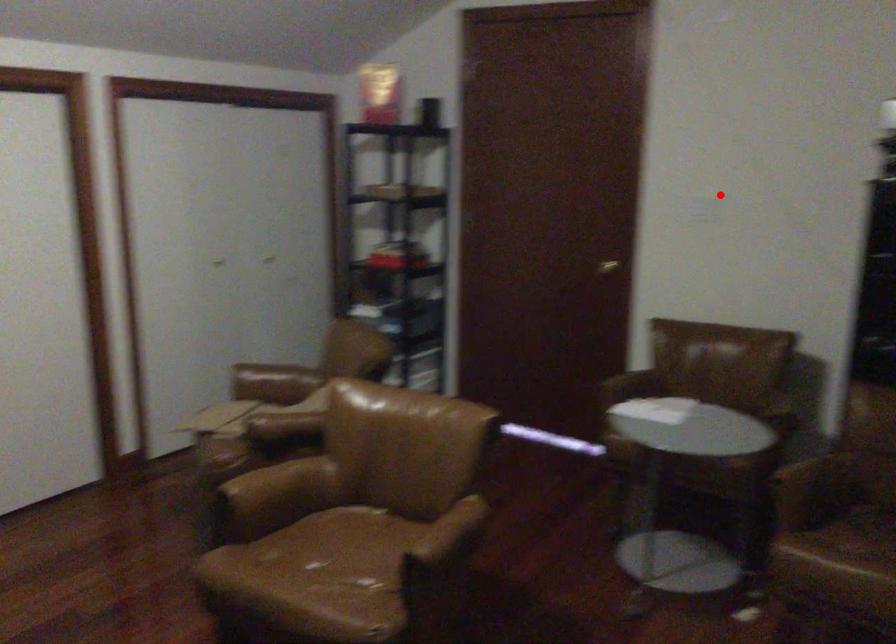
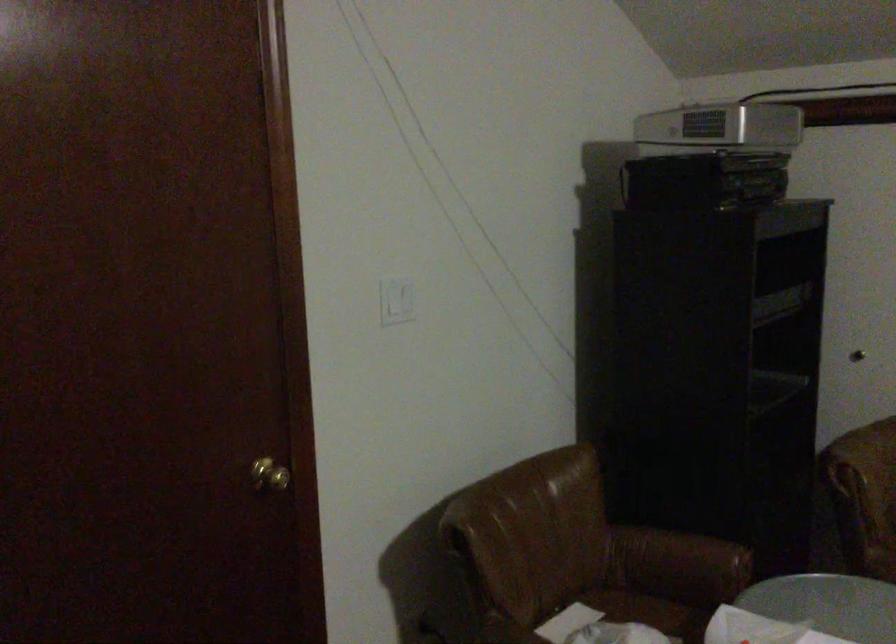
Question: I am providing you with two images of the same scene from different viewpoints. Image1 has a red point marked. In image2, the corresponding 3D location appears at what relative position? Reply with the corresponding letter.

Choices:
 (A) Closer
 (B) Farther

Answer: (A)